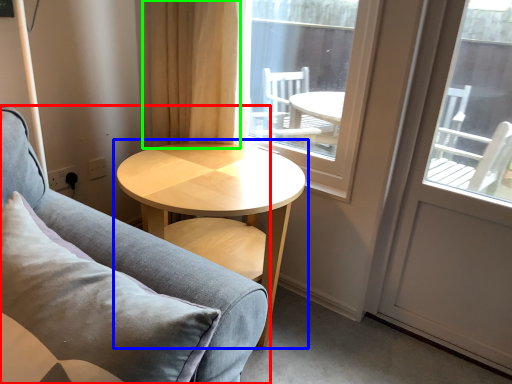
Question: Based on their relative distances, which object is nearer to studio couch (highlighted by a red box)? Choose from coffee table (highlighted by a blue box) and curtain (highlighted by a green box).

Choices:
 (A) coffee table
 (B) curtain

Answer: (A)